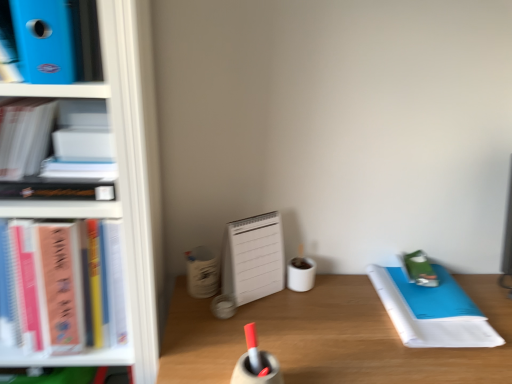
You are a GUI agent. You are given a task and a screenshot of the screen. Output one action in this format:
    pyautogui.click(x=<x>, y=<y>)
    Task: Click on the blank space to the left of green matte notebook at right
    This screenshot has height=384, width=512.
    Given the screenshot: What is the action you would take?
    pyautogui.click(x=351, y=297)